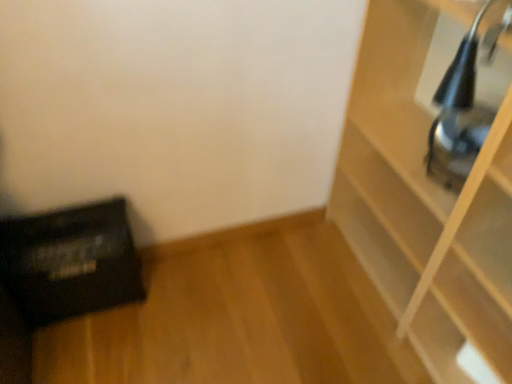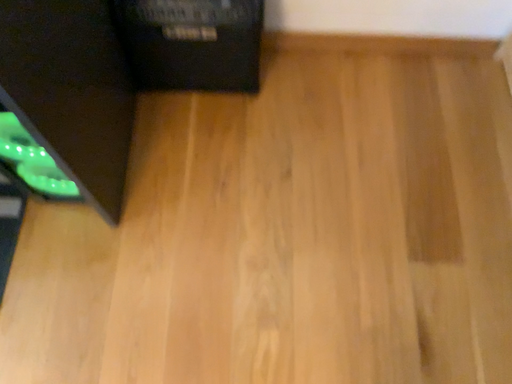
Question: Which way did the camera rotate in the video?

Choices:
 (A) rotated left
 (B) rotated right

Answer: (A)